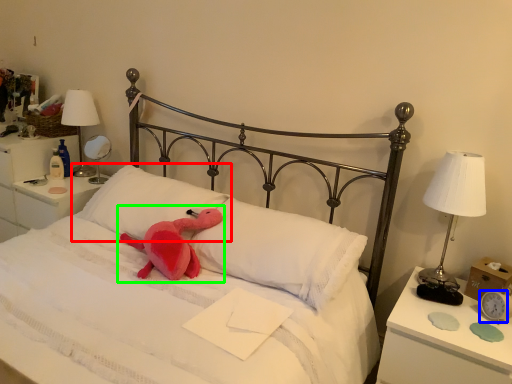
Question: Estimate the real-world distances between objects in this image. Which object is farther from pillow (highlighted by a red box), clock (highlighted by a blue box) or baby elephant (highlighted by a green box)?

Choices:
 (A) clock
 (B) baby elephant

Answer: (A)